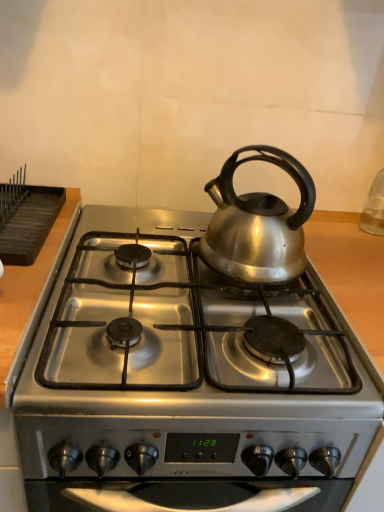
Describe the element at coordinates (186, 378) in the screenshot. I see `satin silver gas stove at center` at that location.

In the scene shown: What is the approximate width of black matte rack at upper left?

It is 12.51 inches.

Where is `satin silver gas stove at center`? satin silver gas stove at center is located at coordinates point(186,378).

From a real-world perspective, between silver metallic kettle at center and black matte rack at upper left, who is vertically higher?

In real-world perspective, silver metallic kettle at center is above.

How different are the orientations of silver metallic kettle at center and black matte rack at upper left in degrees?

There is a 39.5-degree angle between the facing directions of silver metallic kettle at center and black matte rack at upper left.

Where is `kitchen appliance that is on the left side of silver metallic kettle at center`? This screenshot has height=512, width=384. kitchen appliance that is on the left side of silver metallic kettle at center is located at coordinates (30, 225).

From a real-world perspective, is black matte rack at upper left physically located above or below silver metallic kettle at center?

Result: From a real-world perspective, black matte rack at upper left is physically below silver metallic kettle at center.

Does black matte rack at upper left touch silver metallic kettle at center?

No, black matte rack at upper left is not in contact with silver metallic kettle at center.

Which of these two, black matte rack at upper left or silver metallic kettle at center, stands shorter?

black matte rack at upper left is shorter.

Is point (8, 252) closer to viewer compared to point (262, 195)?

Yes.

From the image's perspective, relative to black matte rack at upper left, is satin silver gas stove at center above or below?

Based on their image positions, satin silver gas stove at center is located beneath black matte rack at upper left.

Is satin silver gas stove at center bigger or smaller than black matte rack at upper left?

satin silver gas stove at center is bigger than black matte rack at upper left.

Is satin silver gas stove at center facing away from black matte rack at upper left?

No, satin silver gas stove at center's orientation is not away from black matte rack at upper left.

From a real-world perspective, does satin silver gas stove at center sit lower than black matte rack at upper left?

Yes, from a real-world perspective, satin silver gas stove at center is under black matte rack at upper left.

You are a GUI agent. You are given a task and a screenshot of the screen. Output one action in this format:
    pyautogui.click(x=<x>, y=<y>)
    Task: Click on the kettle that appears above the satin silver gas stove at center (from a real-world perspective)
    This screenshot has height=512, width=384.
    Given the screenshot: What is the action you would take?
    pyautogui.click(x=257, y=223)

Is silver metallic kettle at center not close to satin silver gas stove at center?

No, there isn't a large distance between silver metallic kettle at center and satin silver gas stove at center.

From a real-world perspective, is silver metallic kettle at center positioned under satin silver gas stove at center based on gravity?

No.

Which of these two, silver metallic kettle at center or satin silver gas stove at center, stands taller?

With more height is silver metallic kettle at center.

Between black matte rack at upper left and satin silver gas stove at center, which one is positioned in front?

satin silver gas stove at center is more forward.

Can you tell me how much black matte rack at upper left and satin silver gas stove at center differ in facing direction?

black matte rack at upper left and satin silver gas stove at center are facing 1.26 degrees away from each other.

Locate an element on the screen. kitchen appliance on the left of satin silver gas stove at center is located at coordinates (30, 225).

Considering the sizes of objects black matte rack at upper left and satin silver gas stove at center in the image provided, who is taller, black matte rack at upper left or satin silver gas stove at center?

satin silver gas stove at center is taller.

Is the depth of satin silver gas stove at center greater than that of silver metallic kettle at center?

No, it is in front of silver metallic kettle at center.

Consider the image. Is satin silver gas stove at center wider than silver metallic kettle at center?

Indeed, satin silver gas stove at center has a greater width compared to silver metallic kettle at center.

Measure the distance from satin silver gas stove at center to silver metallic kettle at center.

satin silver gas stove at center and silver metallic kettle at center are 8.22 inches apart from each other.

I want to click on kettle in front of the black matte rack at upper left, so click(257, 223).

The height and width of the screenshot is (512, 384). I want to click on kitchen appliance that appears below the silver metallic kettle at center (from a real-world perspective), so click(30, 225).

From the image, which object appears to be farther from satin silver gas stove at center, silver metallic kettle at center or black matte rack at upper left?

black matte rack at upper left is further to satin silver gas stove at center.

Which object lies nearer to the anchor point black matte rack at upper left, silver metallic kettle at center or satin silver gas stove at center?

satin silver gas stove at center.

Based on their spatial positions, is black matte rack at upper left or satin silver gas stove at center closer to silver metallic kettle at center?

satin silver gas stove at center.

When comparing their distances from satin silver gas stove at center, does black matte rack at upper left or silver metallic kettle at center seem further?

The object further to satin silver gas stove at center is black matte rack at upper left.

Estimate the real-world distances between objects in this image. Which object is further from black matte rack at upper left, satin silver gas stove at center or silver metallic kettle at center?

Based on the image, silver metallic kettle at center appears to be further to black matte rack at upper left.

When comparing their distances from silver metallic kettle at center, does satin silver gas stove at center or black matte rack at upper left seem closer?

satin silver gas stove at center is positioned closer to the anchor silver metallic kettle at center.

The width and height of the screenshot is (384, 512). I want to click on gas stove located between black matte rack at upper left and silver metallic kettle at center in the left-right direction, so click(x=186, y=378).